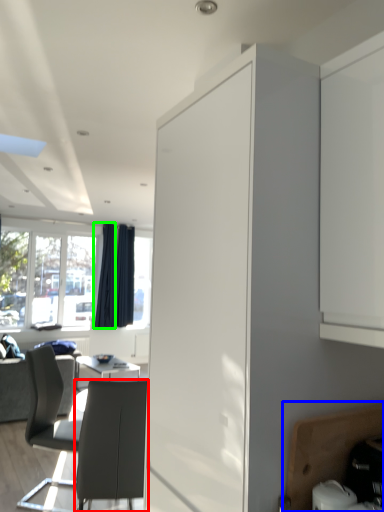
Question: Estimate the real-world distances between objects in this image. Which object is farther from chair (highlighted by a red box), cabinetry (highlighted by a blue box) or curtain (highlighted by a green box)?

Choices:
 (A) cabinetry
 (B) curtain

Answer: (B)